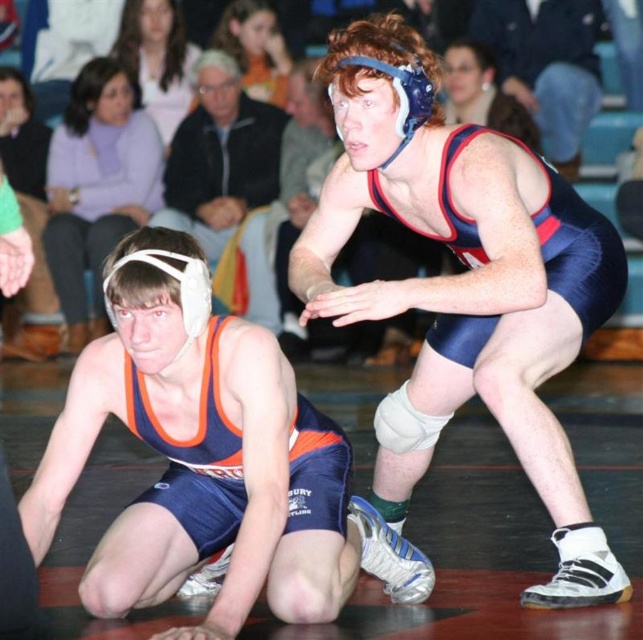
Can you confirm if blue/orange singlet at lower left is wider than matte blue wrestling singlet at upper center?

No.

Is blue/orange singlet at lower left above matte blue wrestling singlet at upper center?

No.

At what (x,y) coordinates should I click in order to perform the action: click on blue/orange singlet at lower left. Please return your answer as a coordinate pair (x, y). Looking at the image, I should click on (206, 444).

Is blue/white wrestling singlet at upper right thinner than blue/orange singlet at lower left?

Incorrect, blue/white wrestling singlet at upper right's width is not less than blue/orange singlet at lower left's.

Who is positioned more to the left, blue/white wrestling singlet at upper right or blue/orange singlet at lower left?

blue/orange singlet at lower left

I want to click on blue/white wrestling singlet at upper right, so click(464, 284).

Can you confirm if blue/white wrestling singlet at upper right is taller than matte blue wrestling singlet at upper center?

Yes, blue/white wrestling singlet at upper right is taller than matte blue wrestling singlet at upper center.

What do you see at coordinates (464, 284) in the screenshot? This screenshot has width=643, height=640. I see `blue/white wrestling singlet at upper right` at bounding box center [464, 284].

Find the location of `blue/white wrestling singlet at upper right`. blue/white wrestling singlet at upper right is located at coordinates (464, 284).